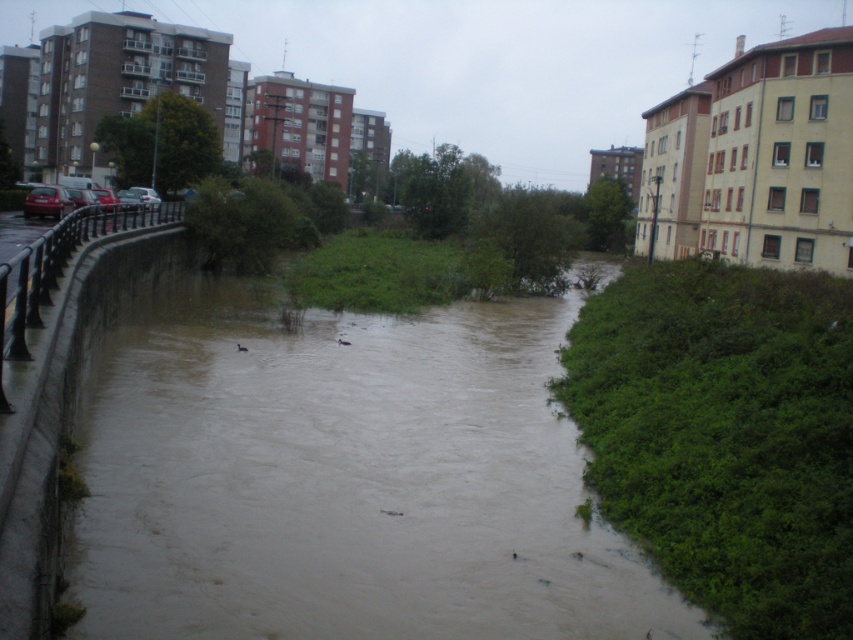
Question: Which object appears closest to the camera in this image?

Choices:
 (A) brown muddy water at center
 (B) shiny red car at left

Answer: (A)

Question: Is brown muddy water at center wider than shiny red car at left?

Choices:
 (A) no
 (B) yes

Answer: (B)

Question: Among these objects, which one is nearest to the camera?

Choices:
 (A) brown muddy water at center
 (B) shiny red car at left

Answer: (A)

Question: Observing the image, what is the correct spatial positioning of brown muddy water at center in reference to shiny red car at left?

Choices:
 (A) above
 (B) below

Answer: (B)

Question: Is brown muddy water at center behind shiny red car at left?

Choices:
 (A) no
 (B) yes

Answer: (A)